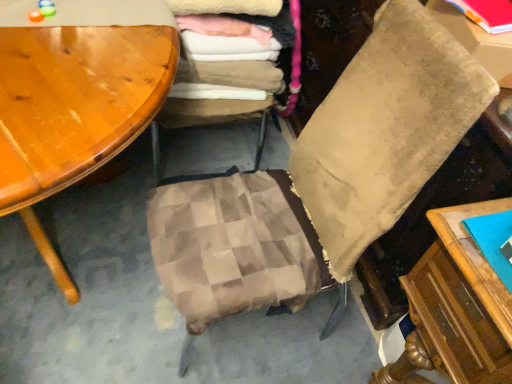
Question: Is matte red book at upper right to the right of matte cardboard box at upper right from the viewer's perspective?

Choices:
 (A) no
 (B) yes

Answer: (A)

Question: Does matte red book at upper right have a lesser width compared to matte cardboard box at upper right?

Choices:
 (A) yes
 (B) no

Answer: (A)

Question: Is matte red book at upper right bigger than matte cardboard box at upper right?

Choices:
 (A) yes
 (B) no

Answer: (B)

Question: From the image's perspective, is matte red book at upper right located above matte cardboard box at upper right?

Choices:
 (A) no
 (B) yes

Answer: (B)

Question: Considering the relative positions of matte red book at upper right and matte cardboard box at upper right in the image provided, is matte red book at upper right to the left of matte cardboard box at upper right from the viewer's perspective?

Choices:
 (A) no
 (B) yes

Answer: (B)

Question: Is matte red book at upper right next to matte cardboard box at upper right and touching it?

Choices:
 (A) yes
 (B) no

Answer: (A)

Question: Considering the relative sizes of matte red book at upper right and beige velvety pillow at center in the image provided, is matte red book at upper right taller than beige velvety pillow at center?

Choices:
 (A) yes
 (B) no

Answer: (B)

Question: Is matte red book at upper right smaller than beige velvety pillow at center?

Choices:
 (A) yes
 (B) no

Answer: (A)

Question: From a real-world perspective, is matte red book at upper right under beige velvety pillow at center?

Choices:
 (A) no
 (B) yes

Answer: (A)

Question: Can you confirm if matte red book at upper right is shorter than beige velvety pillow at center?

Choices:
 (A) yes
 (B) no

Answer: (A)

Question: Is matte red book at upper right positioned in front of beige velvety pillow at center?

Choices:
 (A) yes
 (B) no

Answer: (B)

Question: Is matte red book at upper right placed right next to beige velvety pillow at center?

Choices:
 (A) yes
 (B) no

Answer: (B)

Question: Is beige velvety pillow at center further to the viewer compared to plaid fabric cushion at center?

Choices:
 (A) yes
 (B) no

Answer: (B)